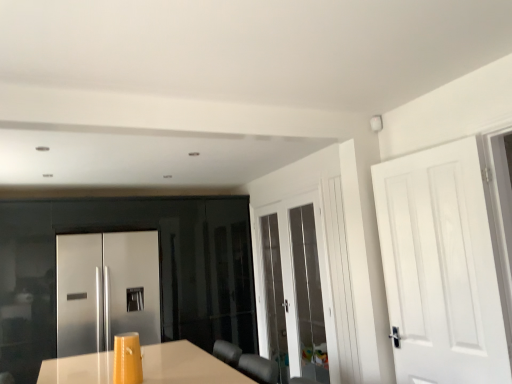
Question: Is satin stainless steel refrigerator at center, marked as the 3th door in a right-to-left arrangement, positioned with its back to white matte door at right, which is the third door from back to front?

Choices:
 (A) no
 (B) yes

Answer: (A)

Question: Is satin stainless steel refrigerator at center, placed as the first door when sorted from back to front, at the right side of white matte door at right, which is the third door from back to front?

Choices:
 (A) yes
 (B) no

Answer: (B)

Question: Is satin stainless steel refrigerator at center, placed as the first door when sorted from back to front, wider than white matte door at right, acting as the 1th door starting from the front?

Choices:
 (A) yes
 (B) no

Answer: (A)

Question: Is satin stainless steel refrigerator at center, marked as the 3th door in a right-to-left arrangement, not within white matte door at right, acting as the 1th door starting from the front?

Choices:
 (A) yes
 (B) no

Answer: (A)

Question: Can you confirm if satin stainless steel refrigerator at center, which is the third door in front-to-back order, is shorter than white matte door at right, which is counted as the first door, starting from the right?

Choices:
 (A) yes
 (B) no

Answer: (A)

Question: Is the depth of satin stainless steel refrigerator at center, marked as the 3th door in a right-to-left arrangement, greater than that of white matte door at right, which is counted as the first door, starting from the right?

Choices:
 (A) no
 (B) yes

Answer: (B)

Question: Can you confirm if white matte door at right, which is counted as the first door, starting from the right, is wider than white glossy door at center, the second door positioned from the left?

Choices:
 (A) no
 (B) yes

Answer: (B)

Question: Is the depth of white matte door at right, which is the third door from back to front, greater than that of white glossy door at center, the second door positioned from the left?

Choices:
 (A) yes
 (B) no

Answer: (B)

Question: From the image's perspective, is white matte door at right, which is counted as the first door, starting from the right, located beneath white glossy door at center, the 2th door when ordered from right to left?

Choices:
 (A) yes
 (B) no

Answer: (B)

Question: Considering the relative positions of white matte door at right, which is the third door from back to front, and white glossy door at center, the second door from the front, in the image provided, is white matte door at right, which is the third door from back to front, to the right of white glossy door at center, the second door from the front, from the viewer's perspective?

Choices:
 (A) yes
 (B) no

Answer: (A)

Question: Considering the relative sizes of white matte door at right, which is the third door from back to front, and white glossy door at center, the second door positioned from the left, in the image provided, is white matte door at right, which is the third door from back to front, taller than white glossy door at center, the second door positioned from the left,?

Choices:
 (A) yes
 (B) no

Answer: (B)

Question: From a real-world perspective, does white matte door at right, which is counted as the first door, starting from the right, sit lower than white glossy door at center, the second door positioned from the left?

Choices:
 (A) yes
 (B) no

Answer: (B)

Question: Are white glossy door at center, the second door from the front, and white matte door at right, which is the third door from back to front, located far from each other?

Choices:
 (A) yes
 (B) no

Answer: (A)